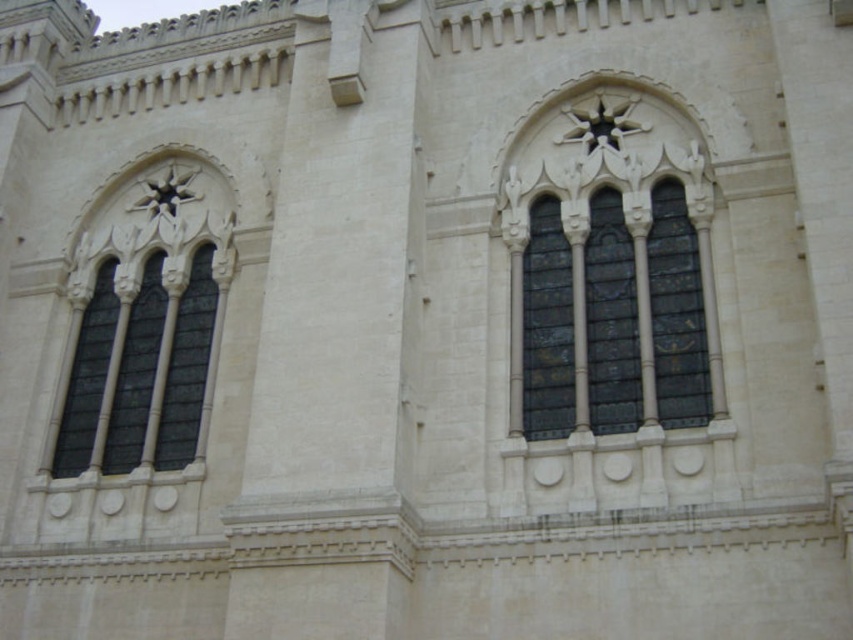
Is point (663, 419) farther from camera compared to point (178, 396)?

No, (663, 419) is closer to viewer.

Can you confirm if stained glass window at center is positioned to the left of dark glass windows at left?

Incorrect, stained glass window at center is not on the left side of dark glass windows at left.

The height and width of the screenshot is (640, 853). What do you see at coordinates (676, 312) in the screenshot?
I see `stained glass window at center` at bounding box center [676, 312].

This screenshot has width=853, height=640. In order to click on stained glass window at center in this screenshot , I will do `click(676, 312)`.